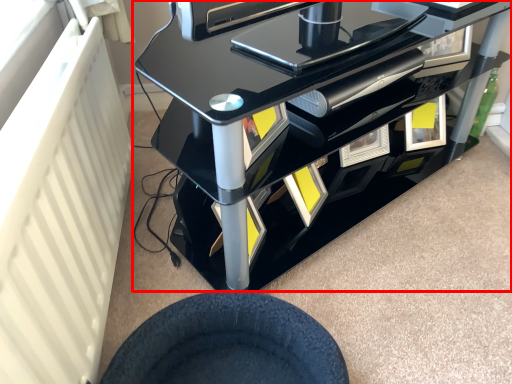
Question: From the image's perspective, what is the correct spatial positioning of furniture (annotated by the red box) in reference to wheel?

Choices:
 (A) below
 (B) above

Answer: (B)